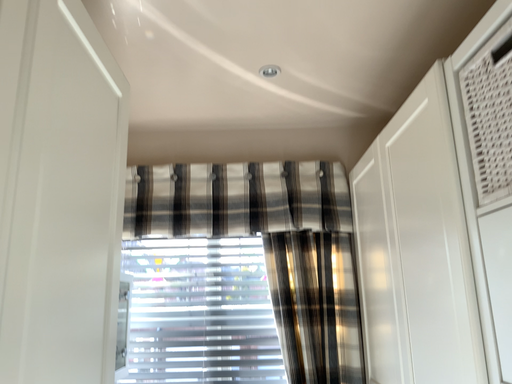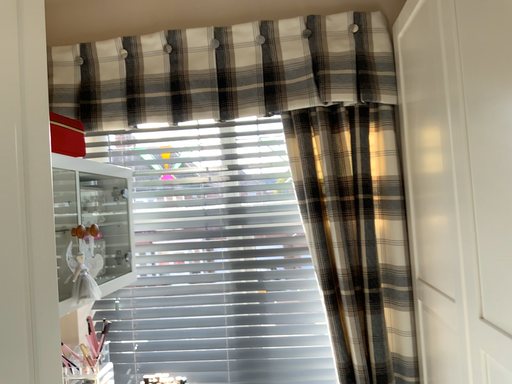
Question: Which way did the camera rotate in the video?

Choices:
 (A) rotated downward
 (B) rotated upward

Answer: (A)